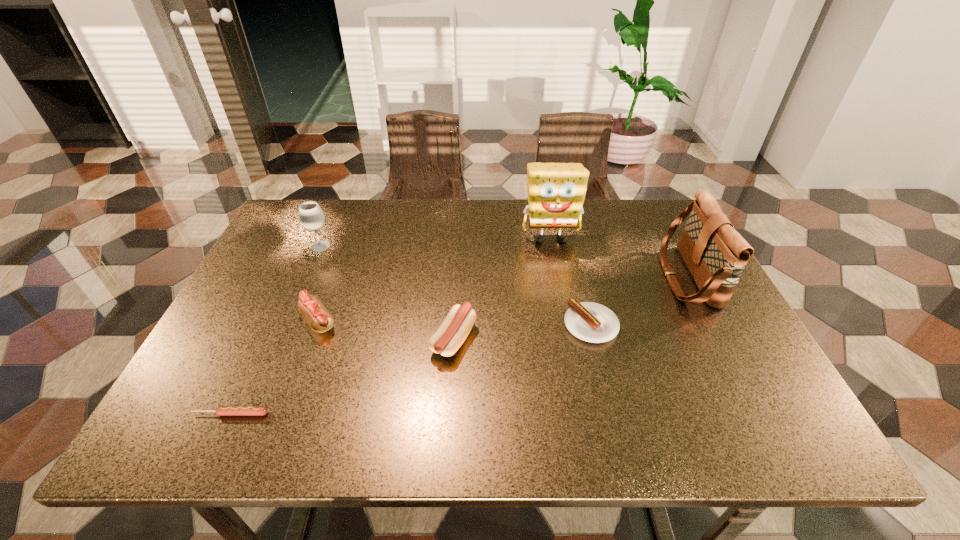
Locate an element on the screen. vacant space located on the front-facing side of the second tallest object is located at coordinates (547, 277).

In order to click on vacant space located 0.340m on the front-facing side of the second tallest object in this screenshot , I will do point(537,277).

At what (x,y) coordinates should I click in order to perform the action: click on free space located 0.060m on the front-facing side of the second tallest object. Please return your answer as a coordinate pair (x, y). The image size is (960, 540). Looking at the image, I should click on (642, 277).

The height and width of the screenshot is (540, 960). I want to click on vacant space situated 0.060m on the left of the wineglass, so click(x=288, y=246).

Image resolution: width=960 pixels, height=540 pixels. Identify the location of free space located on the left of the second sausage from right to left. (335, 339).

Find the location of `vacant space located 0.230m on the back of the third tallest sausage`. vacant space located 0.230m on the back of the third tallest sausage is located at coordinates (572, 248).

Locate an element on the screen. Image resolution: width=960 pixels, height=540 pixels. free space located on the right of the nearest sausage is located at coordinates (451, 414).

Locate an element on the screen. This screenshot has height=540, width=960. sponge that is at the far edge is located at coordinates (556, 191).

Image resolution: width=960 pixels, height=540 pixels. I want to click on shoulder bag that is at the far edge, so click(715, 253).

Find the location of `wineglass that is at the far edge`. wineglass that is at the far edge is located at coordinates (311, 216).